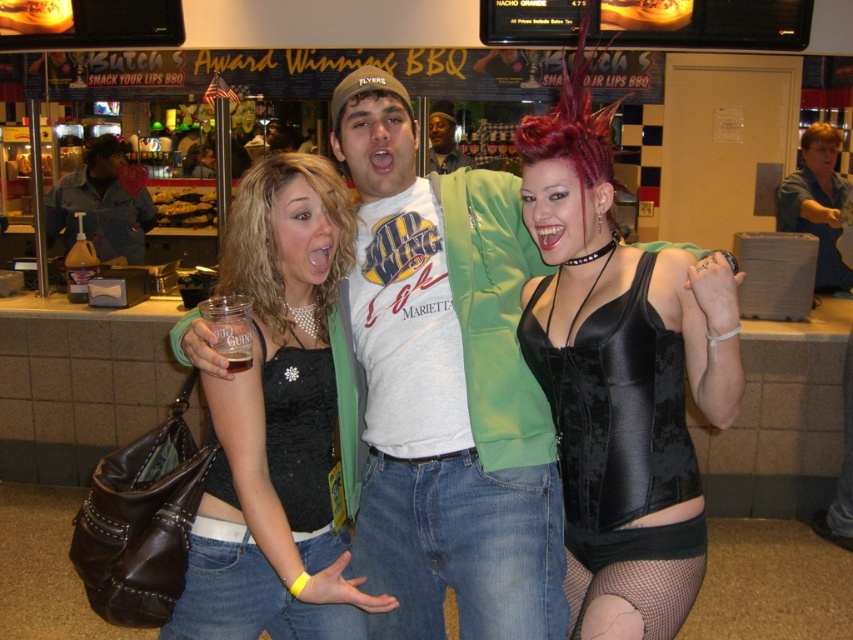
Is point (805, 192) more distant than point (241, 362)?

Yes, point (805, 192) is behind point (241, 362).

Image resolution: width=853 pixels, height=640 pixels. Describe the element at coordinates (817, 204) in the screenshot. I see `matte black corset at center` at that location.

Locate an element on the screen. matte black corset at center is located at coordinates (817, 204).

Between point (306, 609) and point (122, 225), which one is positioned in front?

Point (306, 609)

Describe the element at coordinates (277, 426) in the screenshot. The width and height of the screenshot is (853, 640). I see `matte black tank top at center` at that location.

I want to click on matte black tank top at center, so click(277, 426).

Is matte black corset at center taller than matte white shirt at center?

Indeed, matte black corset at center has a greater height compared to matte white shirt at center.

Does point (784, 228) lie in front of point (437, 128)?

That is True.

Which is behind, point (778, 224) or point (460, 157)?

Positioned behind is point (460, 157).

The width and height of the screenshot is (853, 640). What are the coordinates of `matte black corset at center` in the screenshot? It's located at (817, 204).